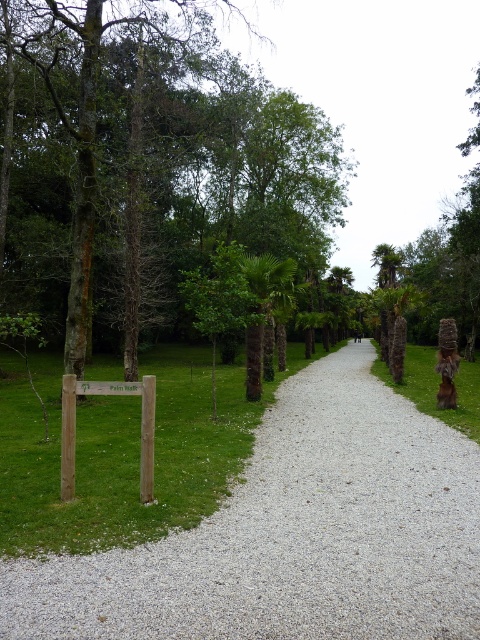
You are a hiker standing at the start of the pathway. You notice the gray gravel at center and the wooden signpost at center. Which object is directly above the other?

The wooden signpost at center is directly above the gray gravel at center because the gray gravel at center is positioned under it.

You are standing on the pathway and want to place a small potted plant between the gray gravel at center and the wooden signpost at center. Which object should the plant be closer to if you want it to be nearer to the viewer?

The gray gravel at center is closer to the viewer than the wooden signpost at center, so placing the plant closer to the gray gravel at center will make it nearer to the viewer.